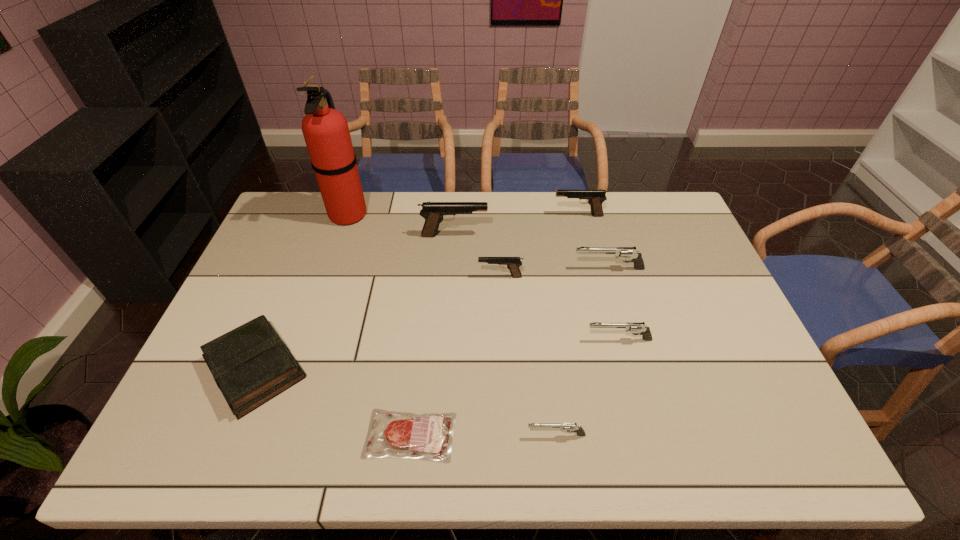
Locate an element on the screen. The width and height of the screenshot is (960, 540). the second closest black pistol relative to the farthest silver pistol is located at coordinates (595, 198).

Where is `silver pistol that is the third closest to the second biggest black pistol`? silver pistol that is the third closest to the second biggest black pistol is located at coordinates (569, 427).

This screenshot has height=540, width=960. Find the location of `the second closest silver pistol to the fifth shortest pistol`. the second closest silver pistol to the fifth shortest pistol is located at coordinates (640, 327).